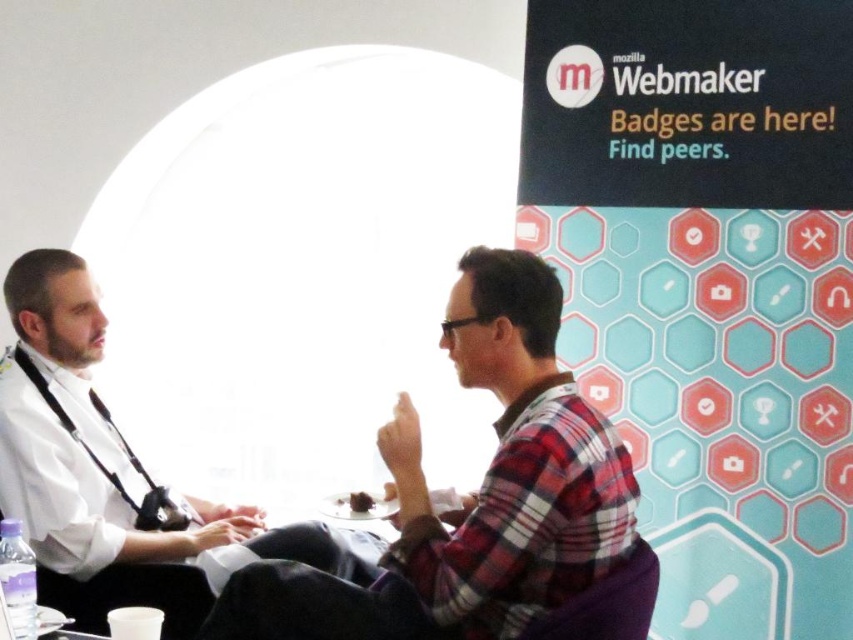
Question: Does plaid fabric shirt at center have a lesser width compared to white matte shirt at left?

Choices:
 (A) yes
 (B) no

Answer: (A)

Question: Does plaid fabric shirt at center appear under white matte shirt at left?

Choices:
 (A) yes
 (B) no

Answer: (A)

Question: Among these objects, which one is farthest from the camera?

Choices:
 (A) white matte shirt at left
 (B) plaid fabric shirt at center

Answer: (A)

Question: Does plaid fabric shirt at center appear under white matte shirt at left?

Choices:
 (A) no
 (B) yes

Answer: (B)

Question: Which of the following is the farthest from the observer?

Choices:
 (A) plaid fabric shirt at center
 (B) white matte shirt at left

Answer: (B)